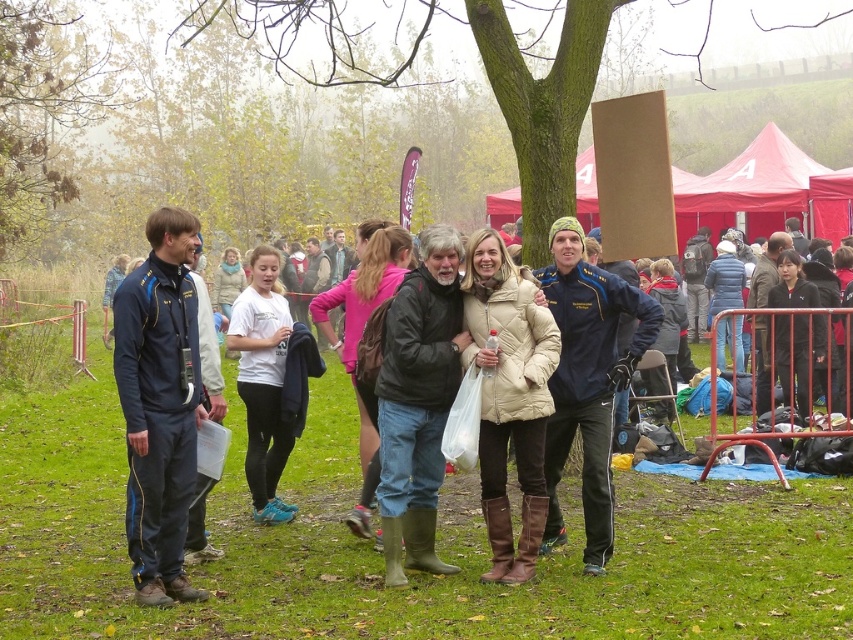
Does point (4, 227) come closer to viewer compared to point (254, 492)?

No, it is not.

Between point (74, 104) and point (260, 420), which one is positioned in front?

Point (260, 420) is more forward.

Where is `brown leafy tree at upper left`? brown leafy tree at upper left is located at coordinates (44, 108).

Is beige quilted coat at center wider than cardboard sign at center?

Incorrect, beige quilted coat at center's width does not surpass cardboard sign at center's.

Is beige quilted coat at center thinner than cardboard sign at center?

Correct, beige quilted coat at center's width is less than cardboard sign at center's.

Describe the element at coordinates (509, 396) in the screenshot. I see `beige quilted coat at center` at that location.

The image size is (853, 640). In order to click on beige quilted coat at center in this screenshot , I will do `click(509, 396)`.

Between matte black jacket at center and blue fabric jacket at center, which one is positioned higher?

blue fabric jacket at center is higher up.

Between point (167, 502) and point (624, 369), which one is positioned behind?

The point (624, 369) is behind.

Locate an element on the screen. matte black jacket at center is located at coordinates (160, 384).